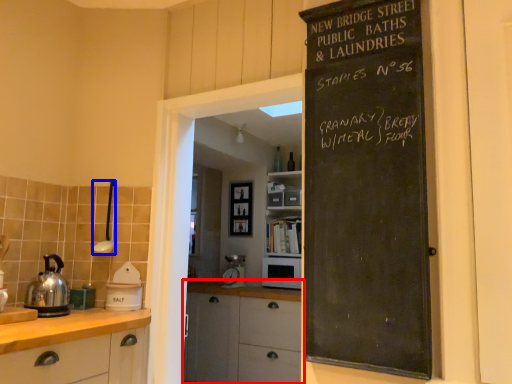
Question: Which of the following is the closest to the observer, cupboard (highlighted by a red box) or appliance (highlighted by a blue box)?

Choices:
 (A) cupboard
 (B) appliance

Answer: (B)